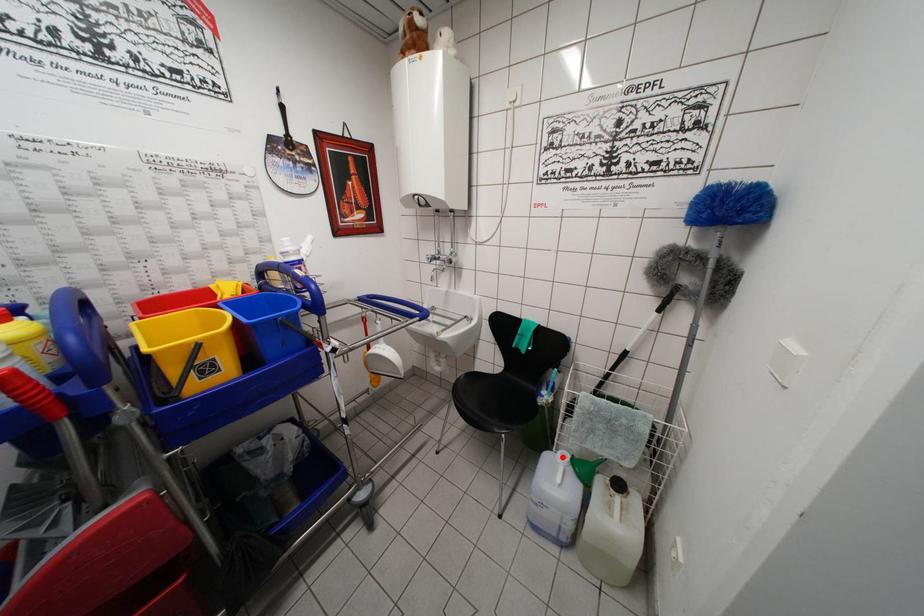
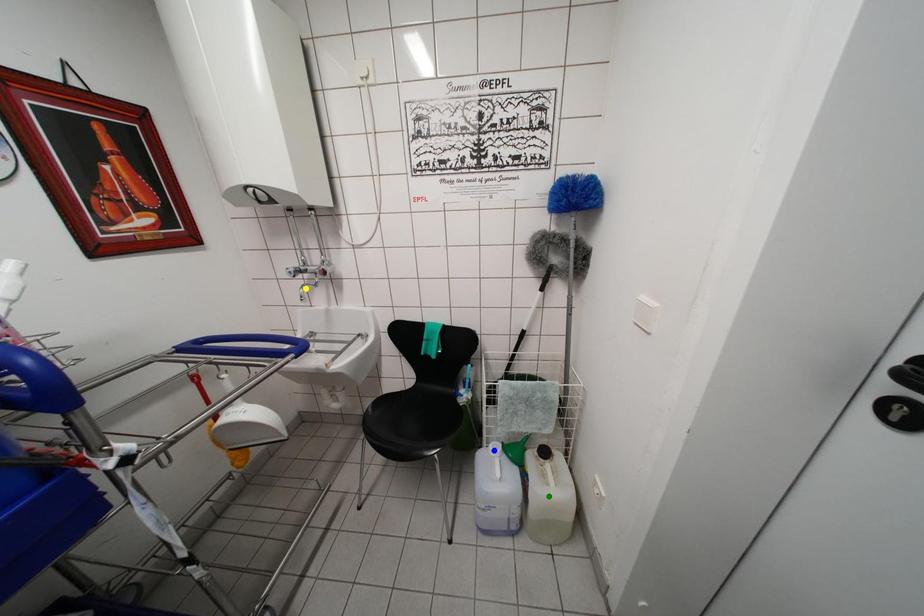
Question: I am providing you with two images of the same scene from different viewpoints. A red point is marked on the first image. You are given multiple points on the second image. Can you choose the point in image 2 that corresponds to the point in image 1?

Choices:
 (A) yellow point
 (B) green point
 (C) blue point

Answer: (C)